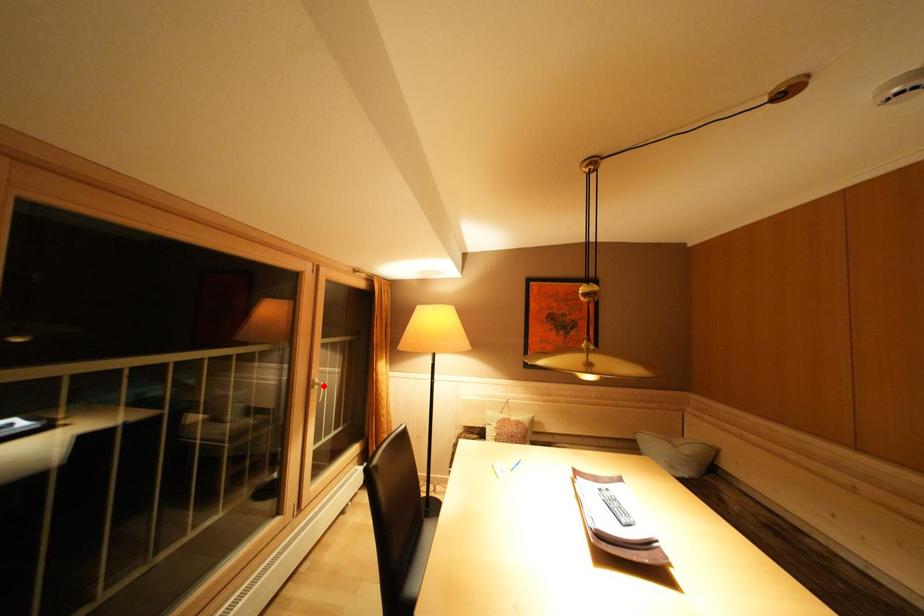
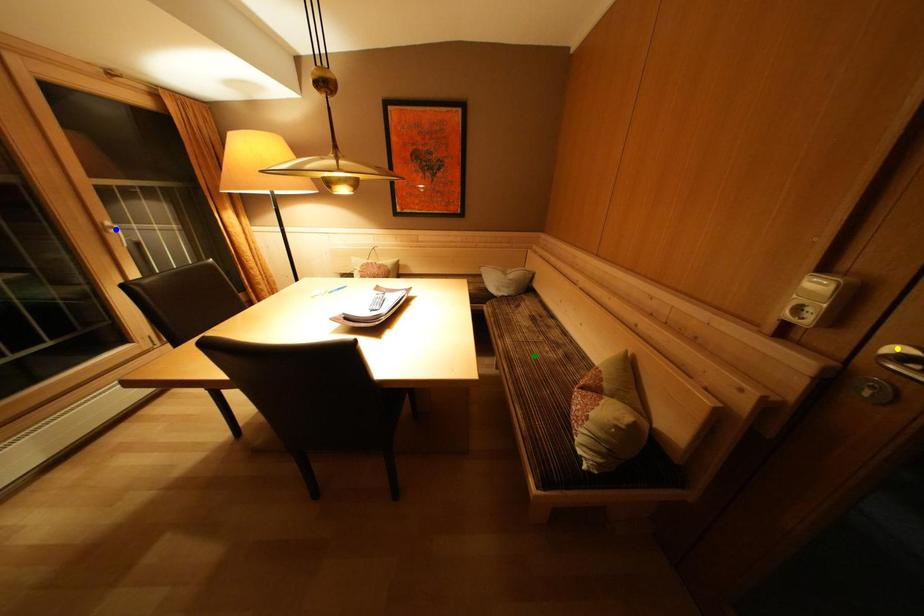
Question: I am providing you with two images of the same scene from different viewpoints. A red point is marked on the first image. You are given multiple points on the second image. Which mark in image 2 goes with the point in image 1?

Choices:
 (A) green point
 (B) blue point
 (C) yellow point

Answer: (B)